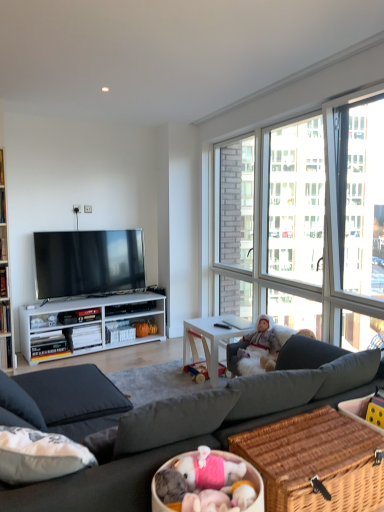
Locate an element on the screen. The image size is (384, 512). woven brown picnic basket at lower right is located at coordinates (316, 462).

Considering the relative positions of white wood desk at center and matte black tv at center in the image provided, is white wood desk at center to the right of matte black tv at center from the viewer's perspective?

Yes, white wood desk at center is to the right of matte black tv at center.

From a real-world perspective, is white wood desk at center below matte black tv at center?

Indeed, from a real-world perspective, white wood desk at center is positioned beneath matte black tv at center.

Where is `television above the white wood desk at center (from the image's perspective)`? television above the white wood desk at center (from the image's perspective) is located at coordinates (88, 262).

Does white wood desk at center have a lesser width compared to white plush doll at center?

No, white wood desk at center is not thinner than white plush doll at center.

Which point is more forward, (211,355) or (264,357)?

The point (264,357) is more forward.

Considering the sizes of objects white wood desk at center and white plush doll at center in the image provided, who is smaller, white wood desk at center or white plush doll at center?

A: With smaller size is white plush doll at center.

Locate an element on the screen. desk directly beneath the white plush doll at center (from a real-world perspective) is located at coordinates (209, 340).

From a real-world perspective, is white plush doll at center positioned under matte black tv at center based on gravity?

Yes, from a real-world perspective, white plush doll at center is below matte black tv at center.

Is the depth of white plush doll at center less than that of matte black tv at center?

Yes, white plush doll at center is closer to the camera.

In the scene shown: From the image's perspective, does white plush doll at center appear lower than matte black tv at center?

Yes, from the image's perspective, white plush doll at center is beneath matte black tv at center.

Does white plush doll at center have a greater width compared to matte black tv at center?

Indeed, white plush doll at center has a greater width compared to matte black tv at center.

Relative to white plush doll at center, is matte black tv at center in front or behind?

Visually, matte black tv at center is located behind white plush doll at center.

Would you consider matte black tv at center to be distant from white plush doll at center?

Absolutely, matte black tv at center is distant from white plush doll at center.

Considering the relative sizes of matte black tv at center and white plush doll at center in the image provided, is matte black tv at center smaller than white plush doll at center?

No.

Does dark gray fabric couch at center have a greater height compared to matte black tv at center?

→ Correct, dark gray fabric couch at center is much taller as matte black tv at center.

Is point (8, 490) behind point (54, 261)?

No, it is in front of (54, 261).

Is dark gray fabric couch at center oriented towards matte black tv at center?

Yes, dark gray fabric couch at center faces towards matte black tv at center.

Can you tell me how much dark gray fabric couch at center and matte black tv at center differ in facing direction?

They differ by 177 degrees in their facing directions.

From the image's perspective, is white wood desk at center located above transparent glass window at upper right?

Actually, white wood desk at center appears below transparent glass window at upper right in the image.

Is white wood desk at center far away from transparent glass window at upper right?

white wood desk at center is positioned a significant distance from transparent glass window at upper right.

From a real-world perspective, between white wood desk at center and transparent glass window at upper right, who is vertically higher?

transparent glass window at upper right.

Which of these two, white wood desk at center or transparent glass window at upper right, is bigger?

transparent glass window at upper right is bigger.

Could white plush doll at center be considered to be inside dark gray fabric couch at center?

Yes.

From a real-world perspective, which is physically below, dark gray fabric couch at center or white plush doll at center?

In real-world perspective, dark gray fabric couch at center is lower.

Can you tell me how much dark gray fabric couch at center and white plush doll at center differ in facing direction?

The angle between the facing direction of dark gray fabric couch at center and the facing direction of white plush doll at center is 88.2 degrees.

Based on the photo, from the image's perspective, which object appears higher, dark gray fabric couch at center or white plush doll at center?

white plush doll at center, from the image's perspective.

In the image, there is a matte black tv at center. In order to click on desk below it (from the image's perspective) in this screenshot , I will do `click(209, 340)`.

Find the location of `desk lying behind the white plush doll at center`. desk lying behind the white plush doll at center is located at coordinates (209, 340).

From the image, which object appears to be farther from transparent glass window at upper right, dark gray fabric couch at center or matte black tv at center?

matte black tv at center lies further to transparent glass window at upper right than the other object.

Estimate the real-world distances between objects in this image. Which object is further from white wood desk at center, woven brown picnic basket at lower right or white plush doll at center?

The object further to white wood desk at center is woven brown picnic basket at lower right.

When comparing their distances from transparent glass window at upper right, does white plush doll at center or matte black tv at center seem closer?

white plush doll at center lies closer to transparent glass window at upper right than the other object.

Which object lies nearer to the anchor point white wood desk at center, dark gray fabric couch at center or matte black tv at center?

The object closer to white wood desk at center is dark gray fabric couch at center.

Which object lies nearer to the anchor point matte black tv at center, dark gray fabric couch at center or white wood desk at center?

dark gray fabric couch at center.

Estimate the real-world distances between objects in this image. Which object is closer to transparent glass window at upper right, woven brown picnic basket at lower right or white plush doll at center?

white plush doll at center lies closer to transparent glass window at upper right than the other object.

Looking at the image, which one is located closer to matte black tv at center, white wood desk at center or transparent glass window at upper right?

white wood desk at center lies closer to matte black tv at center than the other object.

Based on the photo, considering their positions, is matte black tv at center positioned further to woven brown picnic basket at lower right than white wood desk at center?

Based on the image, matte black tv at center appears to be further to woven brown picnic basket at lower right.

Image resolution: width=384 pixels, height=512 pixels. Find the location of `window between woven brown picnic basket at lower right and white plush doll at center from front to back`. window between woven brown picnic basket at lower right and white plush doll at center from front to back is located at coordinates (309, 212).

This screenshot has height=512, width=384. Identify the location of window between dark gray fabric couch at center and white plush doll at center along the z-axis. (309, 212).

Where is `person located between transparent glass window at upper right and white wood desk at center in the depth direction`? The height and width of the screenshot is (512, 384). person located between transparent glass window at upper right and white wood desk at center in the depth direction is located at coordinates (259, 348).

You are a GUI agent. You are given a task and a screenshot of the screen. Output one action in this format:
    pyautogui.click(x=<x>, y=<y>)
    Task: Click on the window between woven brown picnic basket at lower right and white wood desk at center along the z-axis
    The image size is (384, 512).
    Given the screenshot: What is the action you would take?
    pyautogui.click(x=309, y=212)